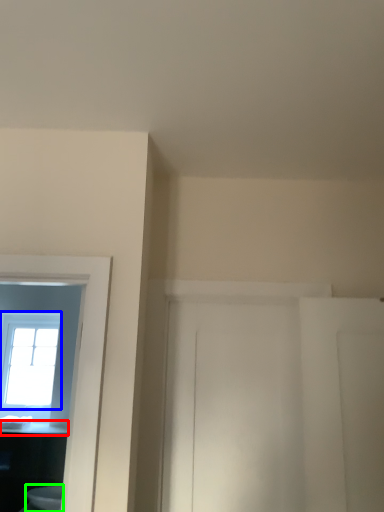
Question: Which object is the farthest from counter top (highlighted by a red box)? Choose among these: window (highlighted by a blue box) or toilet (highlighted by a green box).

Choices:
 (A) window
 (B) toilet

Answer: (A)